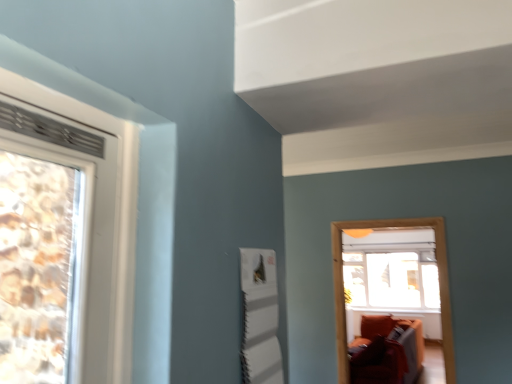
At what (x,y) coordinates should I click in order to perform the action: click on wooden frame at center. Please return your answer as a coordinate pair (x, y). The height and width of the screenshot is (384, 512). Looking at the image, I should click on (439, 285).

What do you see at coordinates (439, 285) in the screenshot? I see `wooden frame at center` at bounding box center [439, 285].

The image size is (512, 384). Describe the element at coordinates (392, 269) in the screenshot. I see `transparent glass window at center` at that location.

What is the approximate height of transparent glass window at center?

It is 4.35 feet.

You are a GUI agent. You are given a task and a screenshot of the screen. Output one action in this format:
    pyautogui.click(x=<x>, y=<y>)
    Task: Click on the transparent glass window at center
    
    Given the screenshot: What is the action you would take?
    pyautogui.click(x=392, y=269)

Consider the image. Measure the distance between transparent glass window at center and camera.

The depth of transparent glass window at center is 6.01 meters.

Where is `wooden frame at center`? This screenshot has width=512, height=384. wooden frame at center is located at coordinates (439, 285).

Is wooden frame at center to the left of transparent glass window at center from the viewer's perspective?

Yes.

From the picture: Between wooden frame at center and transparent glass window at center, which one is positioned behind?

transparent glass window at center is further away from the camera.

Between point (339, 274) and point (417, 246), which one is positioned in front?

The point (339, 274) is closer.

From the image's perspective, relative to transparent glass window at center, is wooden frame at center above or below?

wooden frame at center is situated higher than transparent glass window at center in the image.

From a real-world perspective, is wooden frame at center beneath transparent glass window at center?

No, from a real-world perspective, wooden frame at center is not under transparent glass window at center.

Can you confirm if wooden frame at center is wider than transparent glass window at center?

No, wooden frame at center is not wider than transparent glass window at center.

Considering the relative sizes of wooden frame at center and transparent glass window at center in the image provided, is wooden frame at center shorter than transparent glass window at center?

In fact, wooden frame at center may be taller than transparent glass window at center.

Who is smaller, wooden frame at center or transparent glass window at center?

With smaller size is wooden frame at center.

Is wooden frame at center inside the boundaries of transparent glass window at center, or outside?

wooden frame at center is not inside transparent glass window at center, it's outside.

Is wooden frame at center beside transparent glass window at center?

wooden frame at center and transparent glass window at center are not in contact.

Is wooden frame at center facing towards transparent glass window at center?

No, wooden frame at center is not facing towards transparent glass window at center.

This screenshot has height=384, width=512. What are the coordinates of `window frame that appears above the transparent glass window at center (from the image's perspective)` in the screenshot? It's located at (439, 285).

Which is more to the right, transparent glass window at center or wooden frame at center?

Positioned to the right is transparent glass window at center.

Which object is more forward, transparent glass window at center or wooden frame at center?

wooden frame at center is in front.

Is point (399, 234) closer to camera compared to point (344, 349)?

No.

From the image's perspective, is transparent glass window at center on top of wooden frame at center?

No.

From a real-world perspective, is transparent glass window at center on wooden frame at center?

Actually, transparent glass window at center is physically below wooden frame at center in the real world.

Considering the relative sizes of transparent glass window at center and wooden frame at center in the image provided, is transparent glass window at center thinner than wooden frame at center?

In fact, transparent glass window at center might be wider than wooden frame at center.

Which of these two, transparent glass window at center or wooden frame at center, stands shorter?

With less height is transparent glass window at center.

Considering the relative sizes of transparent glass window at center and wooden frame at center in the image provided, is transparent glass window at center smaller than wooden frame at center?

No, transparent glass window at center is not smaller than wooden frame at center.

Would you say transparent glass window at center is outside wooden frame at center?

Yes, transparent glass window at center is located beyond the bounds of wooden frame at center.

Would you consider transparent glass window at center to be distant from wooden frame at center?

Yes, transparent glass window at center and wooden frame at center are quite far apart.

Is transparent glass window at center positioned with its back to wooden frame at center?

That's not correct — transparent glass window at center is not looking away from wooden frame at center.

The height and width of the screenshot is (384, 512). I want to click on window frame above the transparent glass window at center (from a real-world perspective), so pos(439,285).

Image resolution: width=512 pixels, height=384 pixels. Find the location of `window frame located above the transparent glass window at center (from the image's perspective)`. window frame located above the transparent glass window at center (from the image's perspective) is located at coordinates (439, 285).

Locate an element on the screen. window frame on the left side of transparent glass window at center is located at coordinates (439, 285).